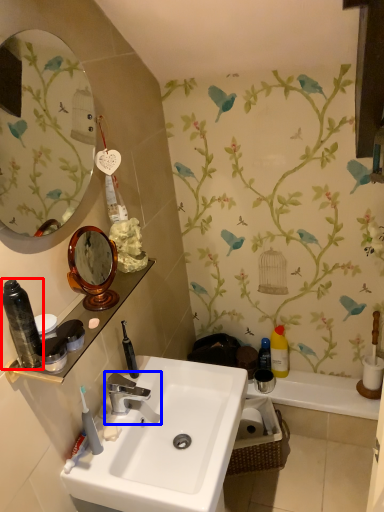
Question: Which point is closer to the camera, toiletry (highlighted by a red box) or tap (highlighted by a blue box)?

Choices:
 (A) toiletry
 (B) tap

Answer: (A)